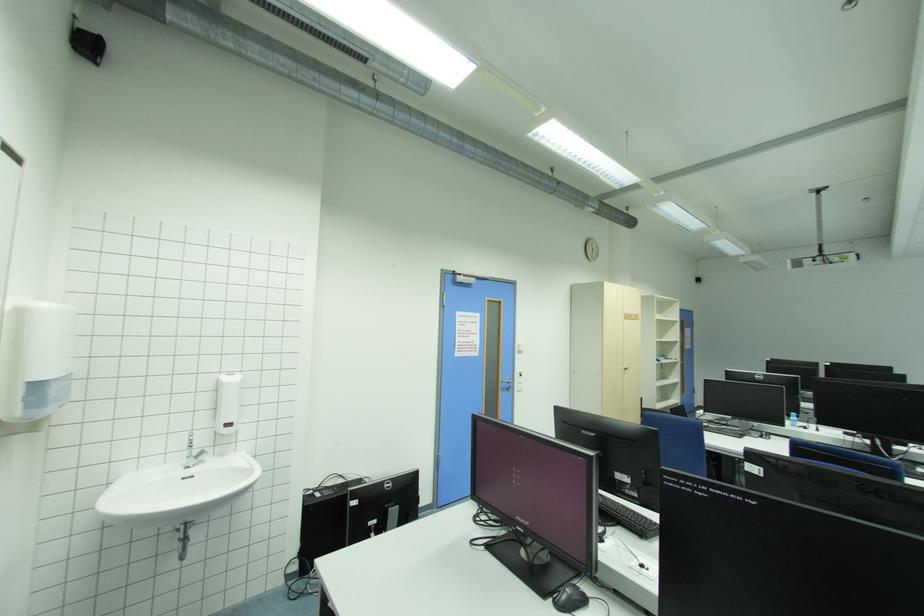
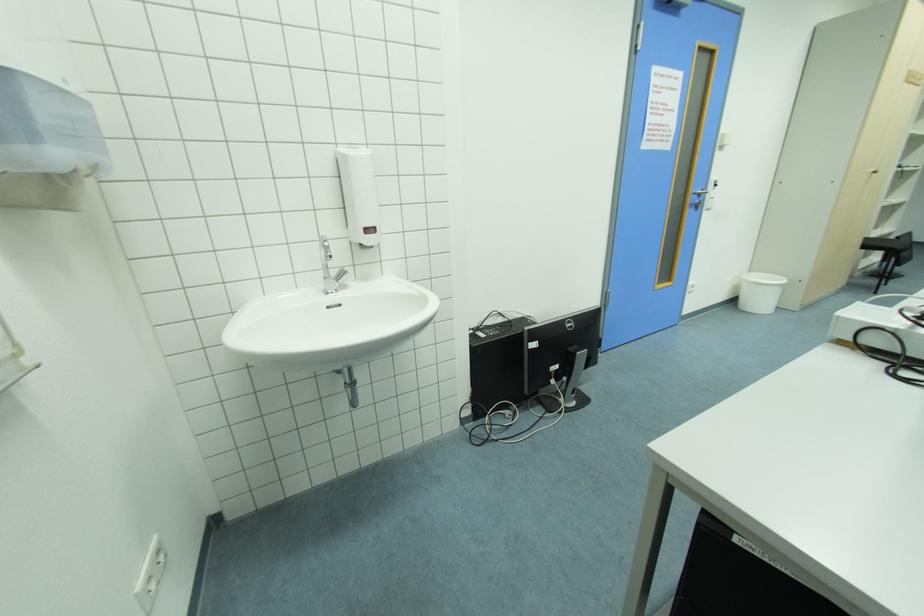
Locate, in the second image, the point that corresponds to (629,369) in the first image.

(878, 172)